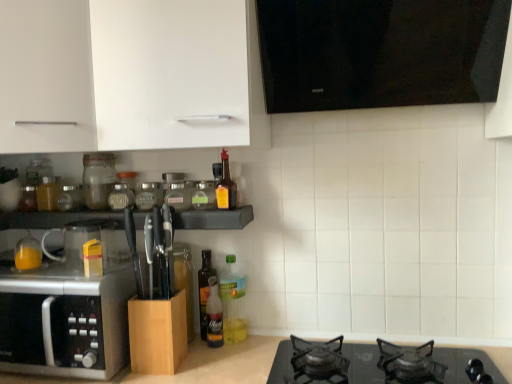
What do you see at coordinates (28, 253) in the screenshot? I see `translucent glass bottle at left, which appears as the fifth bottle when viewed from the right` at bounding box center [28, 253].

Locate an element on the screen. white matte cabinet at upper left, the 2th cabinetry positioned from the top is located at coordinates (129, 74).

Describe the element at coordinates (129, 74) in the screenshot. The height and width of the screenshot is (384, 512). I see `white matte cabinet at upper left, the 2th cabinetry positioned from the top` at that location.

Describe the element at coordinates (55, 219) in the screenshot. I see `wooden knife block at center` at that location.

At what (x,y) coordinates should I click in order to perform the action: click on wooden knife block at center. Please return your answer as a coordinate pair (x, y). Looking at the image, I should click on (55, 219).

Measure the distance between point (x=282, y=360) and camera.

3.69 feet.

Describe the element at coordinates (461, 365) in the screenshot. The width and height of the screenshot is (512, 384). I see `black glass gas stove at lower center` at that location.

Find the location of a particular element. translucent glass bottle at left, which appears as the fifth bottle when viewed from the right is located at coordinates (28, 253).

The height and width of the screenshot is (384, 512). I want to click on vent lying above the translucent plastic bottle at center, which appears as the 6th bottle when viewed from the left (from the image's perspective), so click(380, 52).

Would you say black glossy vent at upper center is part of translucent plastic bottle at center, which ranks as the 1th bottle in right-to-left order,'s contents?

No, black glossy vent at upper center is not surrounded by translucent plastic bottle at center, which ranks as the 1th bottle in right-to-left order.

From the image's perspective, is translucent plastic bottle at center, which ranks as the 1th bottle in right-to-left order, located above or below black glossy vent at upper center?

Based on their image positions, translucent plastic bottle at center, which ranks as the 1th bottle in right-to-left order, is located beneath black glossy vent at upper center.

Considering the sizes of objects translucent plastic bottle at center, which ranks as the 1th bottle in right-to-left order, and black glossy vent at upper center in the image provided, who is smaller, translucent plastic bottle at center, which ranks as the 1th bottle in right-to-left order, or black glossy vent at upper center?

translucent plastic bottle at center, which ranks as the 1th bottle in right-to-left order.

Between point (169, 327) and point (21, 266), which one is positioned behind?

The point (21, 266) is farther from the camera.

Is wooden knife block at center, the first cabinetry from the bottom, facing away from translucent glass bottle at left, which appears as the fifth bottle when viewed from the right?

That's not correct — wooden knife block at center, the first cabinetry from the bottom, is not looking away from translucent glass bottle at left, which appears as the fifth bottle when viewed from the right.

Looking at the image, does wooden knife block at center, which is the 3th cabinetry from top to bottom, seem bigger or smaller compared to translucent glass bottle at left, marked as the 2th bottle in a left-to-right arrangement?

Clearly, wooden knife block at center, which is the 3th cabinetry from top to bottom, is larger in size than translucent glass bottle at left, marked as the 2th bottle in a left-to-right arrangement.

I want to click on the 1st cabinetry in front when counting from the translucent glass bottle at left, which appears as the fifth bottle when viewed from the right, so click(158, 334).

Measure the distance between white matte cabinet at upper left, the second cabinetry from the bottom, and black glass gas stove at lower center.

white matte cabinet at upper left, the second cabinetry from the bottom, is 31.97 inches from black glass gas stove at lower center.

How many degrees apart are the facing directions of white matte cabinet at upper left, the 2th cabinetry positioned from the top, and black glass gas stove at lower center?

The angular difference between white matte cabinet at upper left, the 2th cabinetry positioned from the top, and black glass gas stove at lower center is 1.46 degrees.

Based on their sizes in the image, would you say white matte cabinet at upper left, the second cabinetry from the bottom, is bigger or smaller than black glass gas stove at lower center?

In the image, white matte cabinet at upper left, the second cabinetry from the bottom, appears to be larger than black glass gas stove at lower center.

In the image, is white matte cabinet at upper left, the 2th cabinetry positioned from the top, positioned in front of or behind black glass gas stove at lower center?

white matte cabinet at upper left, the 2th cabinetry positioned from the top, is positioned closer to the viewer than black glass gas stove at lower center.

Are translucent glass bottle at left, which appears as the fifth bottle when viewed from the right, and transparent glass mug at left far apart?

translucent glass bottle at left, which appears as the fifth bottle when viewed from the right, is near transparent glass mug at left, not far away.

Is translucent glass bottle at left, which appears as the fifth bottle when viewed from the right, oriented away from transparent glass mug at left?

No, translucent glass bottle at left, which appears as the fifth bottle when viewed from the right, is not facing the opposite direction of transparent glass mug at left.

Is point (19, 251) in front of point (85, 230)?

Yes, it is in front of point (85, 230).

Between transparent glass mug at left and translucent plastic bottle at upper center, which ranks as the 5th bottle in left-to-right order, which one has larger width?

transparent glass mug at left.

Is transparent glass mug at left in front of or behind translucent plastic bottle at upper center, which is counted as the 2th bottle, starting from the right, in the image?

Visually, transparent glass mug at left is located in front of translucent plastic bottle at upper center, which is counted as the 2th bottle, starting from the right.

How distant is transparent glass mug at left from translucent plastic bottle at upper center, which ranks as the 5th bottle in left-to-right order?

transparent glass mug at left is 18.27 inches away from translucent plastic bottle at upper center, which ranks as the 5th bottle in left-to-right order.

From the image's perspective, is transparent glass mug at left under translucent plastic bottle at upper center, which is counted as the 2th bottle, starting from the right?

Yes, from the image's perspective, transparent glass mug at left is below translucent plastic bottle at upper center, which is counted as the 2th bottle, starting from the right.

Looking at this image, from a real-world perspective, does white matte cabinet at upper left, the 2th cabinetry positioned from the top, stand above black glossy vent at upper center?

No, from a real-world perspective, white matte cabinet at upper left, the 2th cabinetry positioned from the top, is not above black glossy vent at upper center.

Between white matte cabinet at upper left, the second cabinetry from the bottom, and black glossy vent at upper center, which one has less height?

black glossy vent at upper center is shorter.

Is white matte cabinet at upper left, the second cabinetry from the bottom, at the right side of black glossy vent at upper center?

In fact, white matte cabinet at upper left, the second cabinetry from the bottom, is to the left of black glossy vent at upper center.

Would you say white matte cabinet at upper left, the second cabinetry from the bottom, is outside black glossy vent at upper center?

Yes.

Is translucent plastic bottle at center, which appears as the 6th bottle when viewed from the left, facing towards transparent glass mug at left?

No.

Looking at this image, which is more to the right, translucent plastic bottle at center, which ranks as the 1th bottle in right-to-left order, or transparent glass mug at left?

From the viewer's perspective, translucent plastic bottle at center, which ranks as the 1th bottle in right-to-left order, appears more on the right side.

Is translucent plastic bottle at center, which appears as the 6th bottle when viewed from the left, next to transparent glass mug at left?

There is a gap between translucent plastic bottle at center, which appears as the 6th bottle when viewed from the left, and transparent glass mug at left.

From the image's perspective, is translucent plastic bottle at center, which ranks as the 1th bottle in right-to-left order, positioned above or below transparent glass mug at left?

translucent plastic bottle at center, which ranks as the 1th bottle in right-to-left order, is situated lower than transparent glass mug at left in the image.

I want to click on vent in front of the translucent plastic bottle at center, which appears as the 6th bottle when viewed from the left, so click(380, 52).

Which cabinetry is the 2nd one when counting from the right side of the translucent glass bottle at left, which appears as the fifth bottle when viewed from the right? Please provide its 2D coordinates.

[(158, 334)]

Considering their positions, is translucent plastic bottle at upper center, which ranks as the 5th bottle in left-to-right order, positioned closer to translucent plastic bottle at center, which ranks as the 4th bottle in left-to-right order, than transparent glass jar at center, arranged as the 2th glass jar when viewed from the right?

transparent glass jar at center, arranged as the 2th glass jar when viewed from the right, is closer to translucent plastic bottle at center, which ranks as the 4th bottle in left-to-right order.

From the image, which object appears to be farther from white matte cabinet at upper left, which is the 3th cabinetry in bottom-to-top order, black microwave at left or translucent glass bottle at center, the third bottle positioned from the left?

translucent glass bottle at center, the third bottle positioned from the left, is positioned further to the anchor white matte cabinet at upper left, which is the 3th cabinetry in bottom-to-top order.

Looking at the image, which one is located closer to translucent glass jar at upper left, which appears as the first bottle when viewed from the left, transparent glass jar at center, the first glass jar viewed from the right, or translucent plastic bottle at upper center, which ranks as the 5th bottle in left-to-right order?

transparent glass jar at center, the first glass jar viewed from the right, is closer to translucent glass jar at upper left, which appears as the first bottle when viewed from the left.

From the image, which object appears to be farther from wooden knife block at center, the first cabinetry from the bottom, transparent glass jar at center, the first glass jar viewed from the right, or transparent glass jar at center, arranged as the 2th glass jar when viewed from the right?

The object further to wooden knife block at center, the first cabinetry from the bottom, is transparent glass jar at center, the first glass jar viewed from the right.

Looking at the image, which one is located further to translucent glass bottle at center, the third bottle positioned from the left, translucent plastic bottle at center, which ranks as the 1th bottle in right-to-left order, or wooden knife block at center?

Based on the image, wooden knife block at center appears to be further to translucent glass bottle at center, the third bottle positioned from the left.

Looking at the image, which one is located closer to white matte cabinet at upper left, the 2th cabinetry positioned from the top, transparent glass jar at center, which appears as the 1th glass jar when viewed from the left, or translucent plastic bottle at center, which ranks as the 1th bottle in right-to-left order?

The object closer to white matte cabinet at upper left, the 2th cabinetry positioned from the top, is transparent glass jar at center, which appears as the 1th glass jar when viewed from the left.

Which object lies nearer to the anchor point wooden knife block at center, the first cabinetry from the bottom, translucent plastic bottle at center, which ranks as the 4th bottle in left-to-right order, or black glossy vent at upper center?

translucent plastic bottle at center, which ranks as the 4th bottle in left-to-right order.

When comparing their distances from black glass gas stove at lower center, does white matte cabinet at upper left, the 2th cabinetry positioned from the top, or translucent plastic bottle at center, which ranks as the 1th bottle in right-to-left order, seem closer?

Based on the image, translucent plastic bottle at center, which ranks as the 1th bottle in right-to-left order, appears to be nearer to black glass gas stove at lower center.

You are a GUI agent. You are given a task and a screenshot of the screen. Output one action in this format:
    pyautogui.click(x=<x>, y=<y>)
    Task: Click on the kitchen appliance between white matte cabinet at upper left, the second cabinetry from the bottom, and transparent glass jar at center, the first glass jar viewed from the right, from front to back
    This screenshot has width=512, height=384.
    Given the screenshot: What is the action you would take?
    pyautogui.click(x=81, y=242)

This screenshot has width=512, height=384. I want to click on kitchen appliance between translucent glass jar at upper left, which appears as the first bottle when viewed from the left, and transparent glass jar at center, arranged as the 2th glass jar when viewed from the right, so [81, 242].

You are a GUI agent. You are given a task and a screenshot of the screen. Output one action in this format:
    pyautogui.click(x=<x>, y=<y>)
    Task: Click on the home appliance located between translucent glass jar at upper left, which appears as the first bottle when viewed from the left, and translucent glass bottle at center, acting as the fourth bottle starting from the right, in the left-right direction
    Image resolution: width=512 pixels, height=384 pixels.
    Given the screenshot: What is the action you would take?
    pyautogui.click(x=65, y=324)

Find the location of a particular element. shelf located between translucent glass jar at upper left, which appears as the sixth bottle when viewed from the right, and black glossy vent at upper center in the left-right direction is located at coordinates (55, 219).